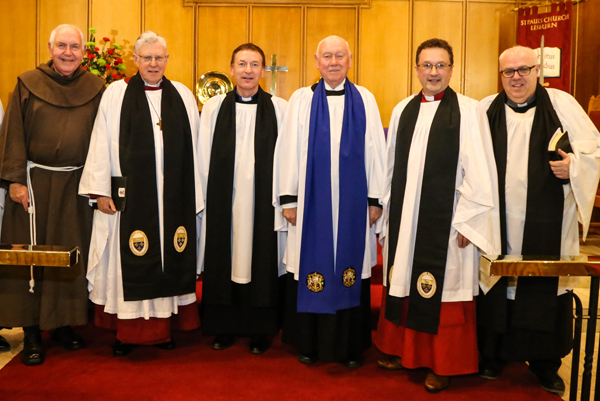
The width and height of the screenshot is (600, 401). Identify the location of wooden wall. (386, 21).